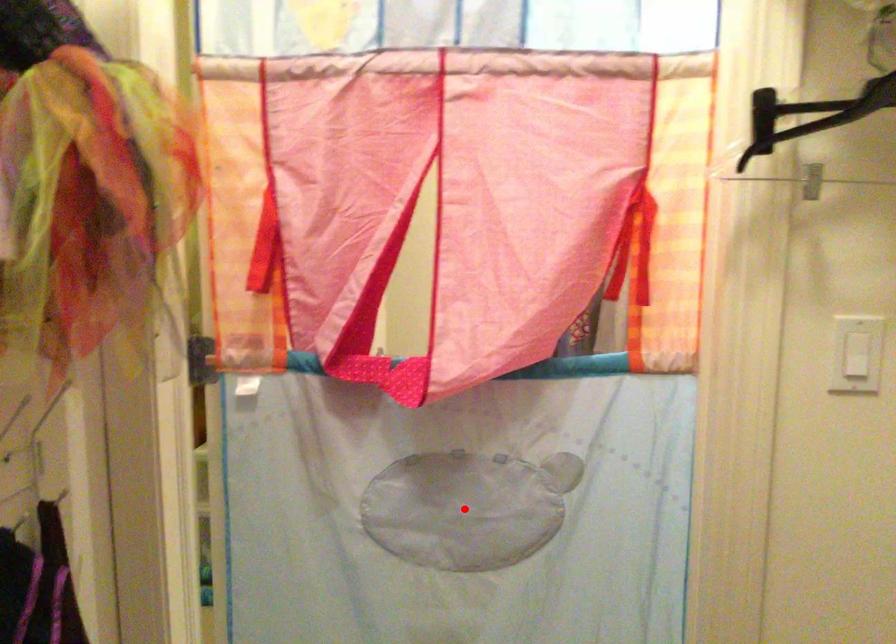
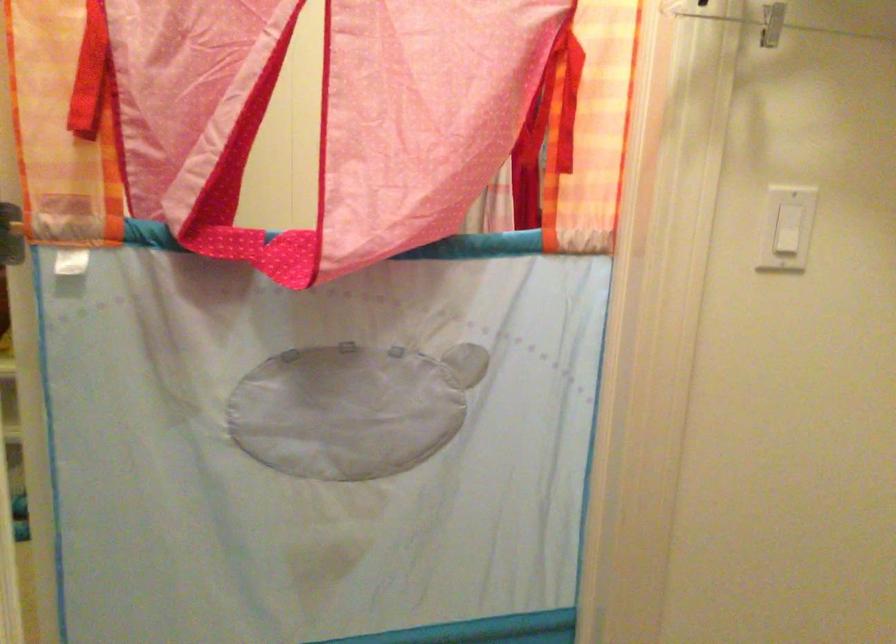
Question: A red point is marked in image1. In image2, is the corresponding 3D point closer to the camera or farther? Reply with the corresponding letter.

Choices:
 (A) The corresponding 3D point is closer.
 (B) The corresponding 3D point is farther.

Answer: (A)